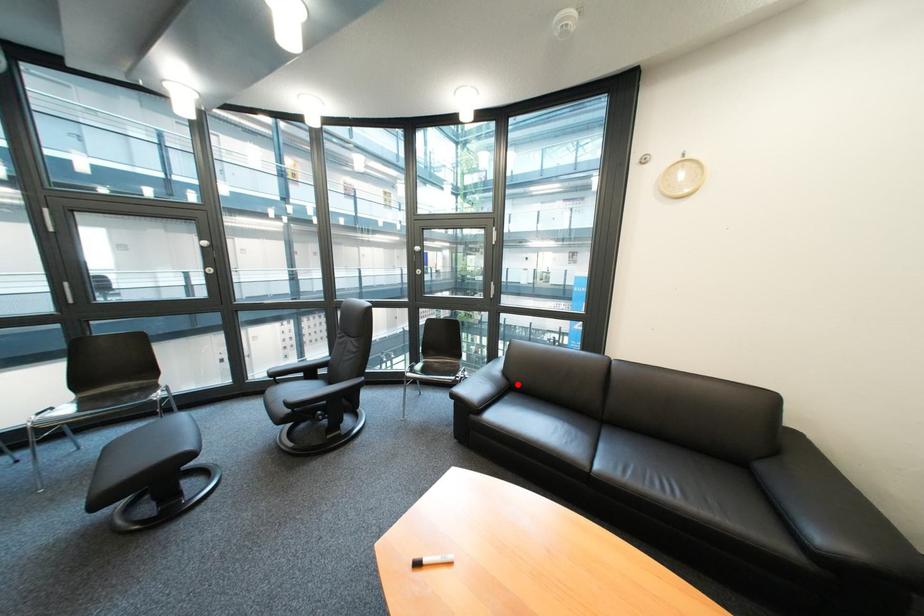
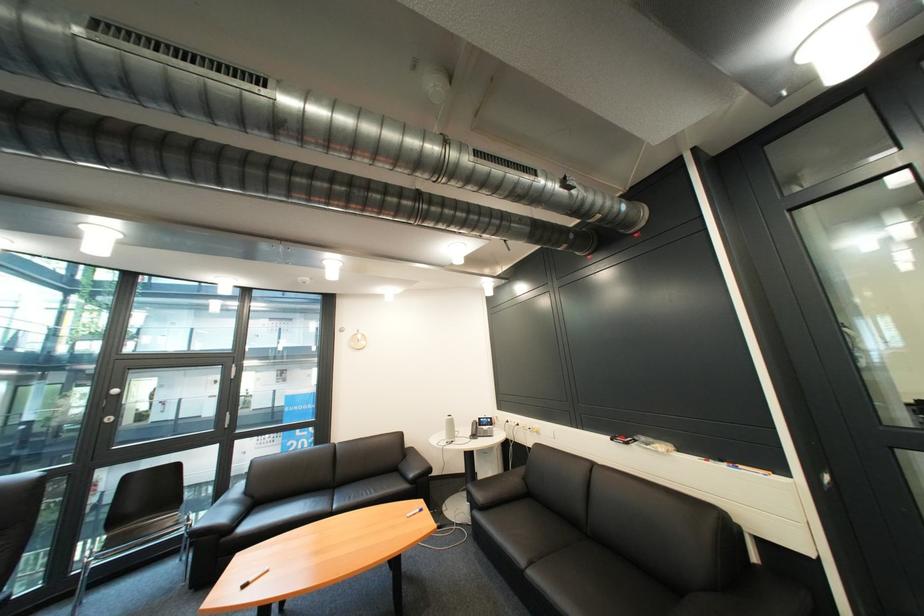
The point at the highlighted location is marked in the first image. Where is the corresponding point in the second image?

(262, 503)